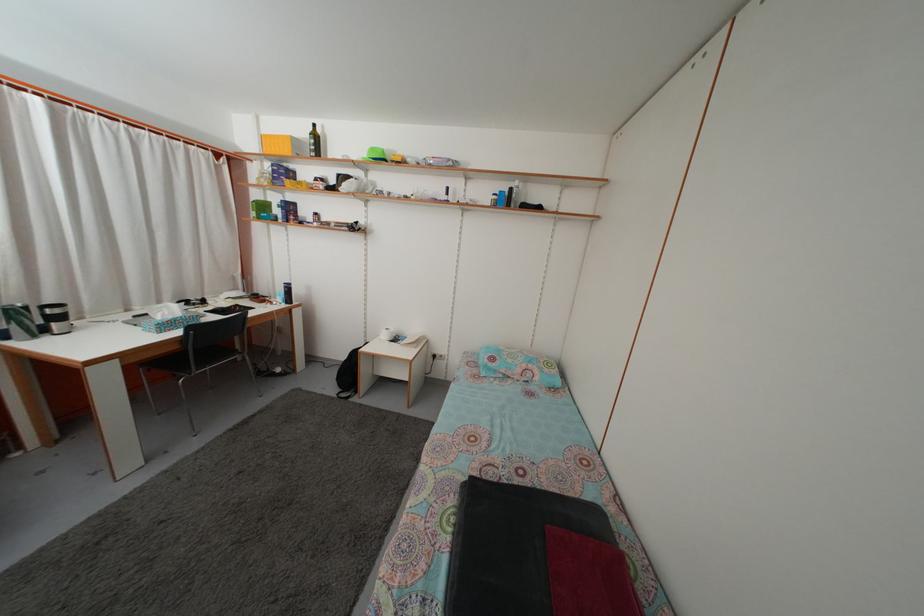
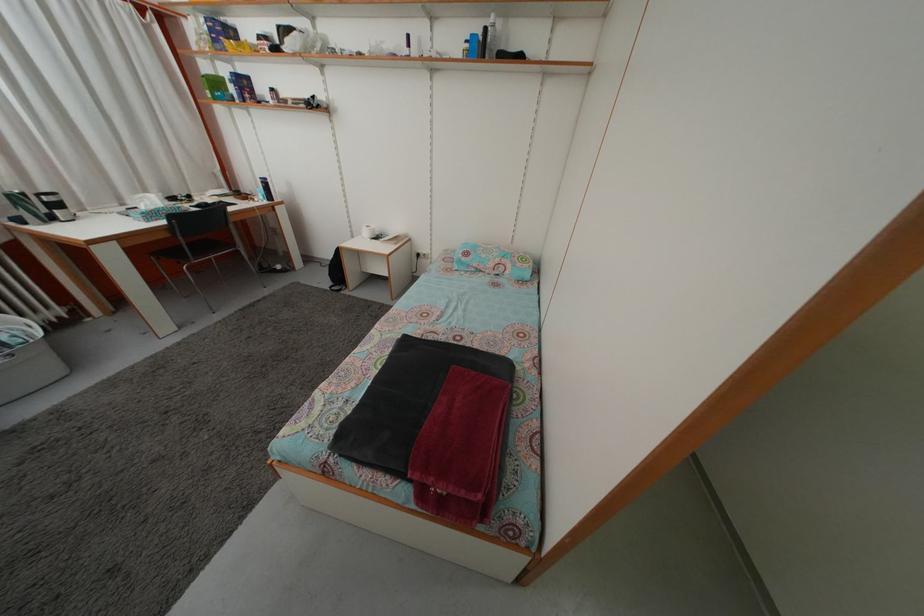
Locate, in the second image, the point that corresponds to (x=347, y=365) in the first image.

(335, 262)